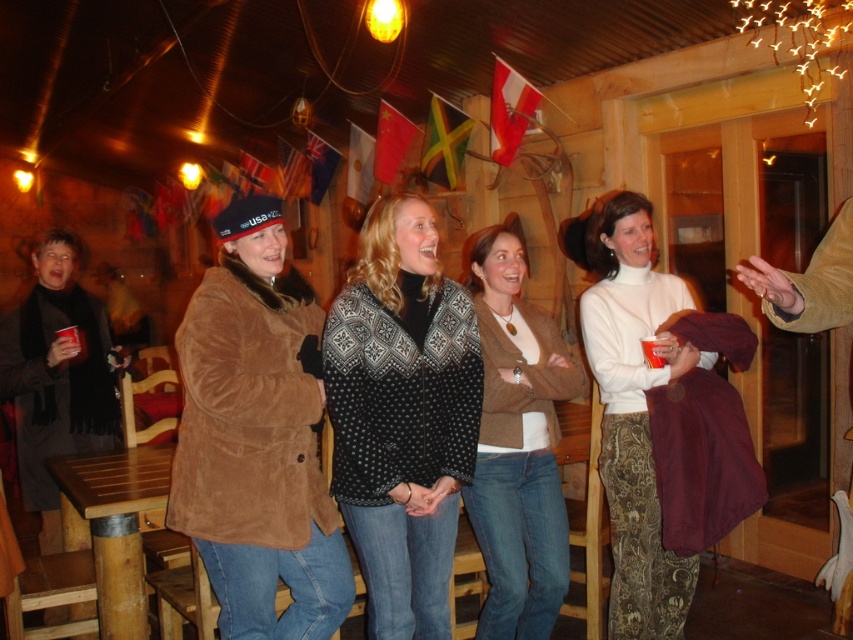
Question: Is suede jacket at center smaller than black knitwear at center?

Choices:
 (A) yes
 (B) no

Answer: (B)

Question: In this image, where is suede jacket at center located relative to black knitwear at center?

Choices:
 (A) left
 (B) right

Answer: (A)

Question: Which of the following is the farthest from the observer?

Choices:
 (A) black knitwear at center
 (B) suede jacket at center

Answer: (A)

Question: Is suede jacket at center positioned before white turtleneck sweater at center?

Choices:
 (A) yes
 (B) no

Answer: (A)

Question: Which of the following is the closest to the observer?

Choices:
 (A) black knitwear at center
 (B) knit sweater at center
 (C) suede jacket at center

Answer: (C)

Question: Which point appears closest to the camera in this image?

Choices:
 (A) (537, 333)
 (B) (592, 216)
 (C) (213, 348)
 (D) (372, 316)

Answer: (C)